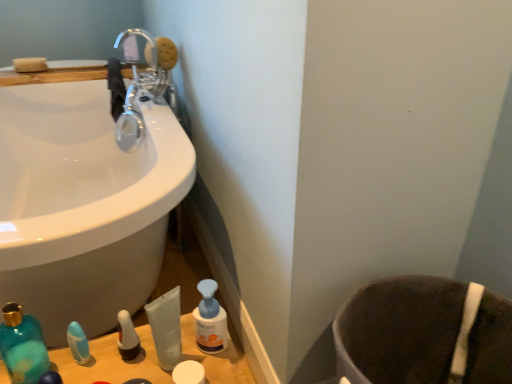
Find the location of `vacant space in between blue glossy tube at lower left, arranged as the 4th toiletry when viewed from the right, and translucent plastic tube at lower center, the 3th toiletry viewed from the left`. vacant space in between blue glossy tube at lower left, arranged as the 4th toiletry when viewed from the right, and translucent plastic tube at lower center, the 3th toiletry viewed from the left is located at coordinates (121, 357).